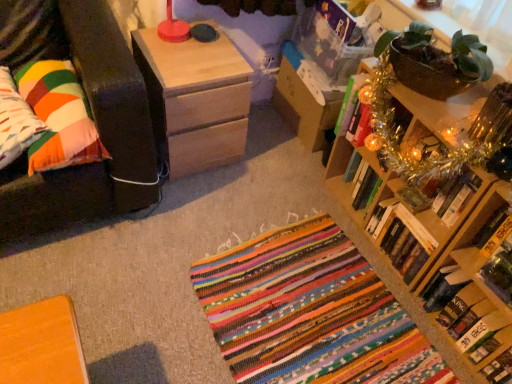
Question: Relative to natural wood nightstand at upper left, is metallic gold book at upper right, the 4th book positioned from the bottom, in front or behind?

Choices:
 (A) front
 (B) behind

Answer: (A)

Question: Is metallic gold book at upper right, the 4th book positioned from the bottom, to the left or to the right of natural wood nightstand at upper left in the image?

Choices:
 (A) left
 (B) right

Answer: (B)

Question: Estimate the real-world distances between objects in this image. Which object is closer to the multicolored fabric pillow at left, marked as the 2th pillow in a right-to-left arrangement?

Choices:
 (A) multicolored woven rug at center
 (B) hardcover book at upper right, the fifth book positioned from the bottom
 (C) metallic gold book at upper right, the 4th book positioned from the bottom
 (D) hardcover book at lower right, arranged as the second book when ordered from the bottom
 (E) multicolored fabric pillow at left, which appears as the first pillow when viewed from the right

Answer: (E)

Question: Considering the real-world distances, which object is farthest from the wooden bookcase at upper right?

Choices:
 (A) hardcover book at upper right, the fifth book positioned from the bottom
 (B) multicolored fabric pillow at left, the 2th pillow from the left
 (C) metallic gold book at upper right, the 4th book positioned from the bottom
 (D) hardcover book at lower right, arranged as the second book when ordered from the bottom
 (E) hardcover book at lower right, arranged as the 5th book when viewed from the top

Answer: (B)